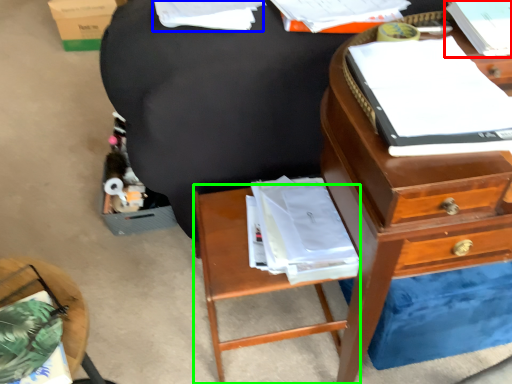
Question: Which object is the farthest from book (highlighted by a red box)? Choose among these: book (highlighted by a blue box) or nightstand (highlighted by a green box).

Choices:
 (A) book
 (B) nightstand

Answer: (B)